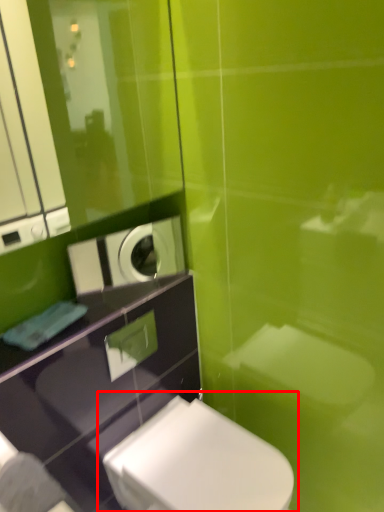
Question: From the image's perspective, what is the correct spatial positioning of toilet (annotated by the red box) in reference to appliance?

Choices:
 (A) below
 (B) above

Answer: (A)